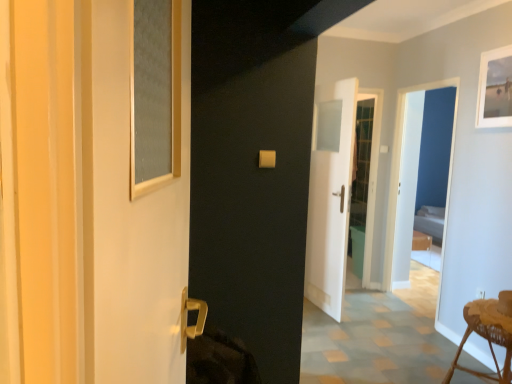
Describe the element at coordinates (430, 222) in the screenshot. This screenshot has height=384, width=512. I see `white fabric bed at right` at that location.

You are a GUI agent. You are given a task and a screenshot of the screen. Output one action in this format:
    pyautogui.click(x=<x>, y=<y>)
    Task: Click on the white fabric bed at right
    The image size is (512, 384).
    Given the screenshot: What is the action you would take?
    tap(430, 222)

Find the location of a particular element. This screenshot has width=512, height=384. white matte picture frame at upper right is located at coordinates (495, 89).

This screenshot has height=384, width=512. What do you see at coordinates (495, 89) in the screenshot?
I see `white matte picture frame at upper right` at bounding box center [495, 89].

You are a GUI agent. You are given a task and a screenshot of the screen. Output one action in this format:
    pyautogui.click(x=<x>, y=<y>)
    Task: Click on the matte glass screen door at left, the first screen door in the front-to-back sequence
    Image resolution: width=512 pixels, height=384 pixels.
    Given the screenshot: What is the action you would take?
    pyautogui.click(x=128, y=215)

Looking at this image, considering the sizes of objects white matte picture frame at upper right and white fabric bed at right in the image provided, who is taller, white matte picture frame at upper right or white fabric bed at right?

Standing taller between the two is white fabric bed at right.

Is white matte picture frame at upper right outside of white fabric bed at right?

Yes, white matte picture frame at upper right is located beyond the bounds of white fabric bed at right.

From a real-world perspective, which object stands above the other?

In real-world perspective, white matte picture frame at upper right is above.

Does point (511, 382) lie behind point (388, 261)?

No, (511, 382) is in front of (388, 261).

Which object is positioned more to the right, woven wood stool at lower right or white glossy screen door at center, which is the first screen door in back-to-front order?

white glossy screen door at center, which is the first screen door in back-to-front order.

Does woven wood stool at lower right have a smaller size compared to white glossy screen door at center, which ranks as the 1th screen door in right-to-left order?

Yes.

Is white glossy screen door at center, which is the first screen door in back-to-front order, in front of white matte picture frame at upper right?

No, it is behind white matte picture frame at upper right.

From the image's perspective, is white glossy screen door at center, which ranks as the 1th screen door in right-to-left order, located above white matte picture frame at upper right?

No.

From a real-world perspective, is white glossy screen door at center, which is the first screen door in back-to-front order, below white matte picture frame at upper right?

Indeed, from a real-world perspective, white glossy screen door at center, which is the first screen door in back-to-front order, is positioned beneath white matte picture frame at upper right.

How different are the orientations of white fabric bed at right and woven wood stool at lower right in degrees?

There is a 74.1-degree angle between the facing directions of white fabric bed at right and woven wood stool at lower right.

Is white fabric bed at right with woven wood stool at lower right?

white fabric bed at right and woven wood stool at lower right are clearly separated.

Does white fabric bed at right have a greater width compared to woven wood stool at lower right?

Yes.

This screenshot has width=512, height=384. I want to click on furniture located on the left of white fabric bed at right, so click(x=489, y=347).

Which of these two, matte glass screen door at left, which ranks as the 2th screen door in right-to-left order, or white glossy screen door at center, which ranks as the 1th screen door in right-to-left order, stands shorter?

matte glass screen door at left, which ranks as the 2th screen door in right-to-left order, is shorter.

Is matte glass screen door at left, the first screen door in the front-to-back sequence, not within white glossy screen door at center, the 2th screen door in the front-to-back sequence?

That's correct, matte glass screen door at left, the first screen door in the front-to-back sequence, is outside of white glossy screen door at center, the 2th screen door in the front-to-back sequence.

From a real-world perspective, does matte glass screen door at left, which is counted as the 2th screen door, starting from the back, stand above white glossy screen door at center, the 2th screen door in the front-to-back sequence?

Yes.

From the image's perspective, is matte glass screen door at left, which ranks as the 2th screen door in right-to-left order, on white glossy screen door at center, which is counted as the second screen door, starting from the left?

No.

Which of these two, white fabric bed at right or white glossy screen door at center, which is the first screen door in back-to-front order, stands taller?

With more height is white glossy screen door at center, which is the first screen door in back-to-front order.

Locate an element on the screen. The height and width of the screenshot is (384, 512). screen door that is the 2nd object located above the white fabric bed at right (from the image's perspective) is located at coordinates (401, 164).

Consider the image. Is white fabric bed at right thinner than white glossy screen door at center, which is the first screen door in back-to-front order?

In fact, white fabric bed at right might be wider than white glossy screen door at center, which is the first screen door in back-to-front order.

Would you say white fabric bed at right is inside or outside white glossy screen door at center, which is counted as the second screen door, starting from the left?

white fabric bed at right exists outside the volume of white glossy screen door at center, which is counted as the second screen door, starting from the left.

From a real-world perspective, is matte glass screen door at left, the first screen door in the front-to-back sequence, above or below white matte picture frame at upper right?

matte glass screen door at left, the first screen door in the front-to-back sequence, is situated lower than white matte picture frame at upper right in the real world.

Is matte glass screen door at left, which ranks as the 2th screen door in right-to-left order, with white matte picture frame at upper right?

No, matte glass screen door at left, which ranks as the 2th screen door in right-to-left order, is not next to white matte picture frame at upper right.

From the picture: Which of these two, matte glass screen door at left, the 1th screen door in the left-to-right sequence, or white matte picture frame at upper right, is wider?

With larger width is matte glass screen door at left, the 1th screen door in the left-to-right sequence.

Would you say white matte picture frame at upper right is part of matte glass screen door at left, the 1th screen door in the left-to-right sequence,'s contents?

No, white matte picture frame at upper right is located outside of matte glass screen door at left, the 1th screen door in the left-to-right sequence.

Image resolution: width=512 pixels, height=384 pixels. I want to click on bed below the white matte picture frame at upper right (from a real-world perspective), so click(x=430, y=222).

Image resolution: width=512 pixels, height=384 pixels. In order to click on screen door behind the woven wood stool at lower right in this screenshot , I will do [x=401, y=164].

Based on their spatial positions, is woven wood stool at lower right or white matte picture frame at upper right further from white fabric bed at right?

Among the two, woven wood stool at lower right is located further to white fabric bed at right.

Estimate the real-world distances between objects in this image. Which object is further from matte glass screen door at left, the first screen door in the front-to-back sequence, white glossy screen door at center, the 2th screen door in the front-to-back sequence, or woven wood stool at lower right?

white glossy screen door at center, the 2th screen door in the front-to-back sequence.

From the image, which object appears to be farther from woven wood stool at lower right, matte glass screen door at left, which ranks as the 2th screen door in right-to-left order, or white glossy screen door at center, which ranks as the 1th screen door in right-to-left order?

matte glass screen door at left, which ranks as the 2th screen door in right-to-left order.

When comparing their distances from woven wood stool at lower right, does white matte picture frame at upper right or matte glass screen door at left, which is counted as the 2th screen door, starting from the back, seem closer?

Among the two, white matte picture frame at upper right is located nearer to woven wood stool at lower right.

Looking at the image, which one is located closer to white fabric bed at right, woven wood stool at lower right or matte glass screen door at left, which ranks as the 2th screen door in right-to-left order?

woven wood stool at lower right.

Estimate the real-world distances between objects in this image. Which object is further from woven wood stool at lower right, white fabric bed at right or matte glass screen door at left, which ranks as the 2th screen door in right-to-left order?

white fabric bed at right is positioned further to the anchor woven wood stool at lower right.

Looking at the image, which one is located closer to white fabric bed at right, white glossy screen door at center, the 2th screen door in the front-to-back sequence, or woven wood stool at lower right?

white glossy screen door at center, the 2th screen door in the front-to-back sequence, is closer to white fabric bed at right.

From the image, which object appears to be farther from woven wood stool at lower right, white fabric bed at right or white matte picture frame at upper right?

Among the two, white fabric bed at right is located further to woven wood stool at lower right.

Where is `picture frame between matte glass screen door at left, the first screen door in the front-to-back sequence, and white fabric bed at right, along the z-axis`? The image size is (512, 384). picture frame between matte glass screen door at left, the first screen door in the front-to-back sequence, and white fabric bed at right, along the z-axis is located at coordinates (495, 89).

Locate an element on the screen. picture frame located between woven wood stool at lower right and white fabric bed at right in the depth direction is located at coordinates (495, 89).

Image resolution: width=512 pixels, height=384 pixels. In order to click on furniture between matte glass screen door at left, the first screen door in the front-to-back sequence, and white matte picture frame at upper right in the front-back direction in this screenshot , I will do `click(489, 347)`.

In order to click on screen door positioned between white matte picture frame at upper right and white fabric bed at right from near to far in this screenshot , I will do `click(401, 164)`.